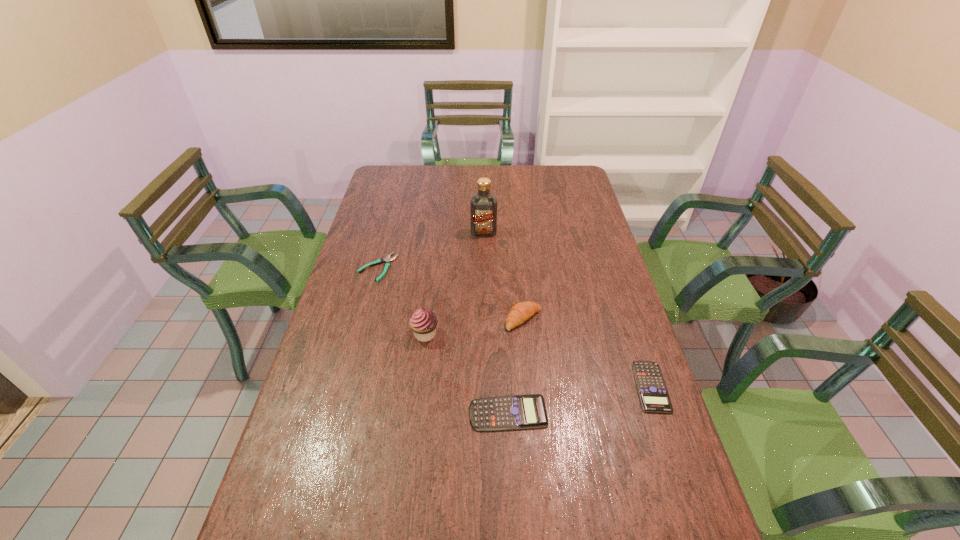
Where is `the taller calculator`? This screenshot has width=960, height=540. the taller calculator is located at coordinates (513, 412).

Find the location of a particular element. the right calculator is located at coordinates (653, 394).

The width and height of the screenshot is (960, 540). In order to click on the shorter calculator in this screenshot , I will do `click(653, 394)`.

The width and height of the screenshot is (960, 540). I want to click on vodka, so click(x=483, y=206).

Locate an element on the screen. The height and width of the screenshot is (540, 960). the tallest object is located at coordinates (483, 206).

Where is `the third tallest object`? Image resolution: width=960 pixels, height=540 pixels. the third tallest object is located at coordinates (520, 312).

I want to click on the fifth object from right to left, so click(423, 322).

The width and height of the screenshot is (960, 540). I want to click on the fifth shortest object, so click(x=423, y=322).

At what (x,y) coordinates should I click in order to perform the action: click on the leftmost object. Please return your answer as a coordinate pair (x, y). The height and width of the screenshot is (540, 960). Looking at the image, I should click on (387, 260).

At what (x,y) coordinates should I click in order to perform the action: click on the second farthest object. Please return your answer as a coordinate pair (x, y). The image size is (960, 540). Looking at the image, I should click on point(387,260).